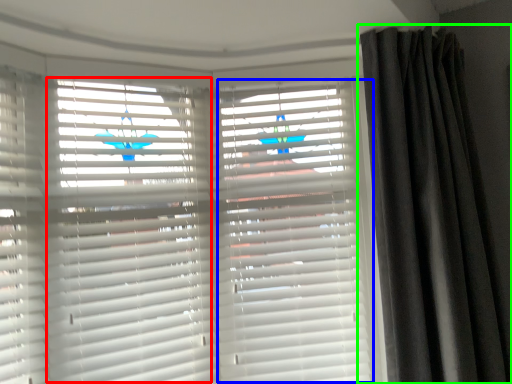
Question: Which object is the farthest from shutter (highlighted by a red box)? Choose among these: shutter (highlighted by a blue box) or curtain (highlighted by a green box).

Choices:
 (A) shutter
 (B) curtain

Answer: (B)